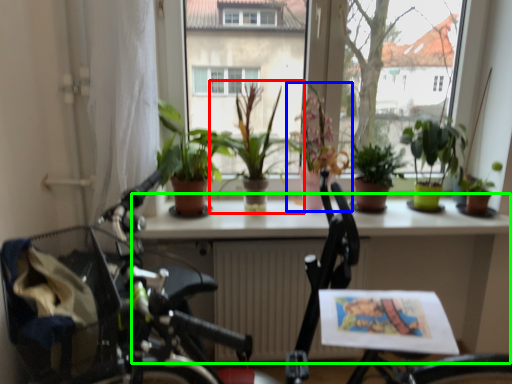
Question: Which object is positioned farthest from houseplant (highlighted by a red box)? Select from houseplant (highlighted by a blue box) and table (highlighted by a green box).

Choices:
 (A) houseplant
 (B) table

Answer: (B)